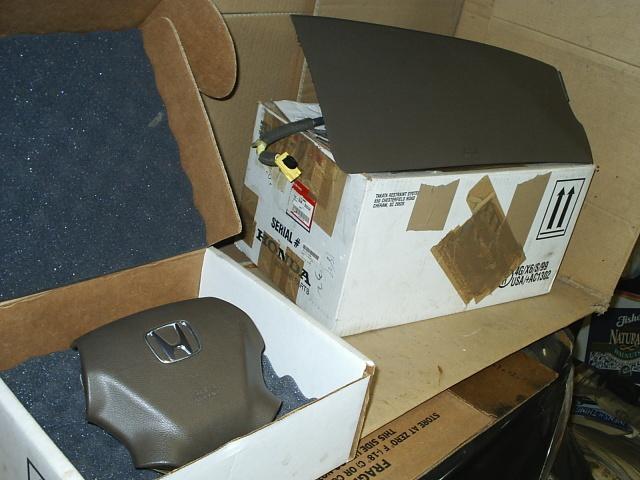
Where is `foam padding`? The height and width of the screenshot is (480, 640). foam padding is located at coordinates (81, 156), (57, 406).